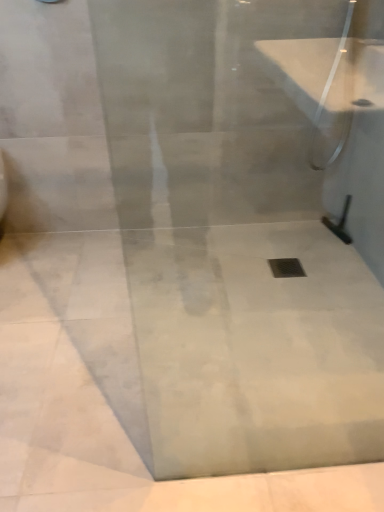
Question: From a real-world perspective, is clear glass shower door at upper right, which ranks as the first shower in top-to-bottom order, positioned under metallic silver drain at center based on gravity?

Choices:
 (A) yes
 (B) no

Answer: (B)

Question: Are clear glass shower door at upper right, which ranks as the first shower in top-to-bottom order, and metallic silver drain at center making contact?

Choices:
 (A) no
 (B) yes

Answer: (A)

Question: From the image's perspective, is clear glass shower door at upper right, which ranks as the first shower in top-to-bottom order, over metallic silver drain at center?

Choices:
 (A) no
 (B) yes

Answer: (B)

Question: Does clear glass shower door at upper right, which ranks as the first shower in top-to-bottom order, have a greater height compared to metallic silver drain at center?

Choices:
 (A) no
 (B) yes

Answer: (B)

Question: Does clear glass shower door at upper right, which ranks as the first shower in top-to-bottom order, lie behind metallic silver drain at center?

Choices:
 (A) yes
 (B) no

Answer: (B)

Question: From a real-world perspective, does clear glass shower door at upper right, which ranks as the first shower in top-to-bottom order, stand above metallic silver drain at center?

Choices:
 (A) yes
 (B) no

Answer: (A)

Question: Is metallic silver drain at center completely or partially inside black rubber squeegee at right, marked as the 2th shower in a top-to-bottom arrangement?

Choices:
 (A) no
 (B) yes

Answer: (A)

Question: Is black rubber squeegee at right, marked as the 2th shower in a top-to-bottom arrangement, shorter than metallic silver drain at center?

Choices:
 (A) yes
 (B) no

Answer: (B)

Question: From the image's perspective, is black rubber squeegee at right, which is the first shower in bottom-to-top order, below metallic silver drain at center?

Choices:
 (A) no
 (B) yes

Answer: (A)

Question: From a real-world perspective, is black rubber squeegee at right, marked as the 2th shower in a top-to-bottom arrangement, located higher than metallic silver drain at center?

Choices:
 (A) yes
 (B) no

Answer: (A)

Question: Is black rubber squeegee at right, which is the first shower in bottom-to-top order, turned away from metallic silver drain at center?

Choices:
 (A) no
 (B) yes

Answer: (A)

Question: Is black rubber squeegee at right, marked as the 2th shower in a top-to-bottom arrangement, smaller than metallic silver drain at center?

Choices:
 (A) yes
 (B) no

Answer: (B)

Question: From the image's perspective, is white marble concrete at center above clear glass shower door at upper right, which ranks as the first shower in top-to-bottom order?

Choices:
 (A) yes
 (B) no

Answer: (B)